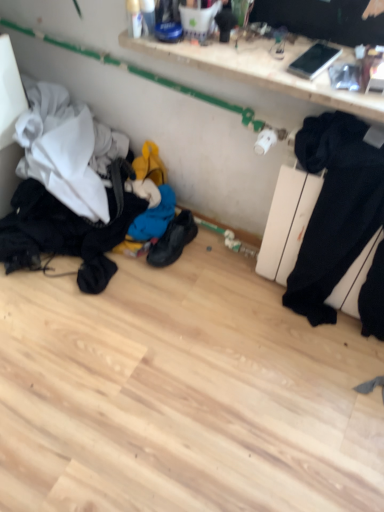
What are the coordinates of `free space to the left of black leather shoes at center` in the screenshot? It's located at (126, 266).